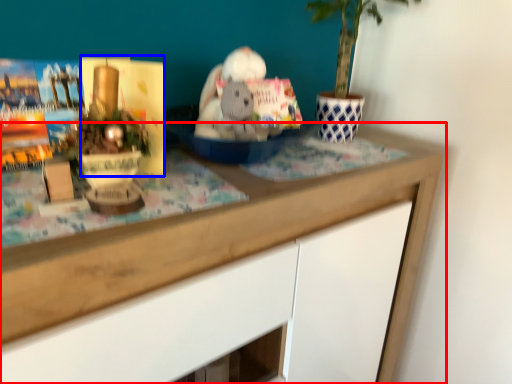
Question: Which point is closer to the camera, desk (highlighted by a red box) or paperback book (highlighted by a blue box)?

Choices:
 (A) desk
 (B) paperback book

Answer: (A)